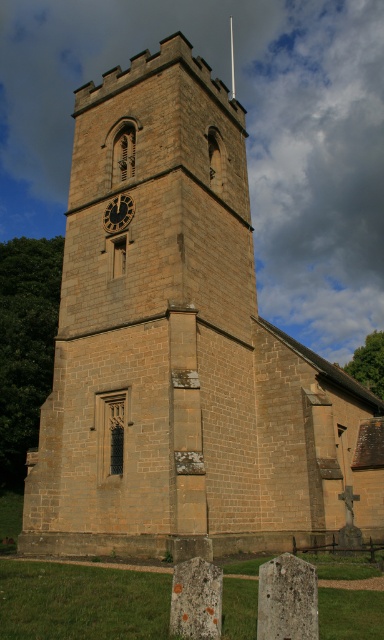
You are standing in front of the historic stone church tower and want to place a decorative flagpole. The flagpole needs to be placed above the dark brown stone clock at center but below the smooth stone spire at upper center. Is this possible?

The dark brown stone clock at center is below the smooth stone spire at upper center, so yes, you can place the flagpole above the dark brown stone clock at center but below the smooth stone spire at upper center.

You are standing in front of the historic stone church tower. You see the dark brown stone clock at center and the smooth stone spire at upper center. Which object is located to the left of the other?

The dark brown stone clock at center is positioned on the left side of smooth stone spire at upper center.